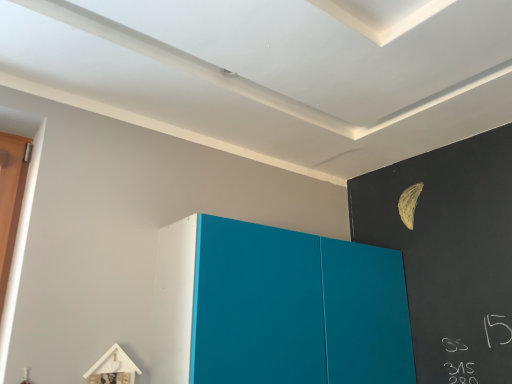
What do you see at coordinates (278, 307) in the screenshot? This screenshot has width=512, height=384. I see `teal matte cabinet at center` at bounding box center [278, 307].

In order to click on teal matte cabinet at center in this screenshot , I will do `click(278, 307)`.

Where is `teal matte cabinet at center`? teal matte cabinet at center is located at coordinates (278, 307).